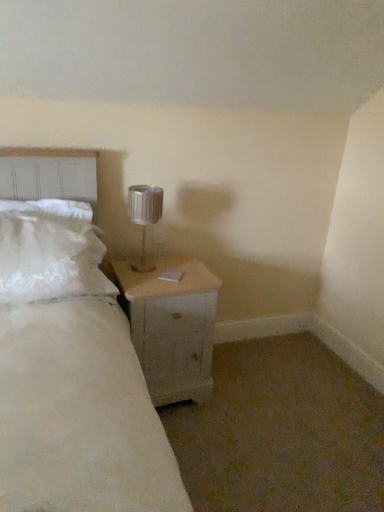
What do you see at coordinates (50, 252) in the screenshot? I see `white fluffy pillow at left` at bounding box center [50, 252].

Identify the location of metallic silver lamp at upper right. The height and width of the screenshot is (512, 384). (145, 219).

This screenshot has width=384, height=512. Find the location of `pillow in front of the metallic silver lamp at upper right`. pillow in front of the metallic silver lamp at upper right is located at coordinates (50, 252).

Can you tell me how much white fluffy pillow at left and metallic silver lamp at upper right differ in facing direction?

The facing directions of white fluffy pillow at left and metallic silver lamp at upper right are 1.27 degrees apart.

Is point (74, 209) less distant than point (138, 195)?

Yes, it is in front of point (138, 195).

Considering the sizes of white fluffy pillow at left and metallic silver lamp at upper right in the image, is white fluffy pillow at left wider or thinner than metallic silver lamp at upper right?

Clearly, white fluffy pillow at left has more width compared to metallic silver lamp at upper right.

In terms of width, does white wood nightstand at lower right look wider or thinner when compared to metallic silver lamp at upper right?

In the image, white wood nightstand at lower right appears to be wider than metallic silver lamp at upper right.

From the image's perspective, who appears lower, white wood nightstand at lower right or metallic silver lamp at upper right?

From the image's view, white wood nightstand at lower right is below.

Would you consider white wood nightstand at lower right to be distant from metallic silver lamp at upper right?

Actually, white wood nightstand at lower right and metallic silver lamp at upper right are a little close together.

You are a GUI agent. You are given a task and a screenshot of the screen. Output one action in this format:
    pyautogui.click(x=<x>, y=<y>)
    Task: Click on the lamp behind the white wood nightstand at lower right
    This screenshot has height=512, width=384.
    Given the screenshot: What is the action you would take?
    pyautogui.click(x=145, y=219)

Where is `nightstand that is under the metallic silver lamp at upper right (from a real-world perspective)`? nightstand that is under the metallic silver lamp at upper right (from a real-world perspective) is located at coordinates (172, 326).

From the image's perspective, is metallic silver lamp at upper right located above or below white wood nightstand at lower right?

metallic silver lamp at upper right is situated higher than white wood nightstand at lower right in the image.

Looking at this image, is metallic silver lamp at upper right touching white wood nightstand at lower right?

No, metallic silver lamp at upper right is not next to white wood nightstand at lower right.

Is metallic silver lamp at upper right located outside white wood nightstand at lower right?

Yes, metallic silver lamp at upper right is outside of white wood nightstand at lower right.

From the image's perspective, which one is positioned lower, metallic silver lamp at upper right or white fluffy pillow at left?

white fluffy pillow at left appears lower in the image.

Does metallic silver lamp at upper right contain white fluffy pillow at left?

No, white fluffy pillow at left is not surrounded by metallic silver lamp at upper right.

From their relative heights in the image, would you say metallic silver lamp at upper right is taller or shorter than white fluffy pillow at left?

Considering their sizes, metallic silver lamp at upper right has less height than white fluffy pillow at left.

Which of these two, metallic silver lamp at upper right or white fluffy pillow at left, is thinner?

Thinner between the two is metallic silver lamp at upper right.

Can you confirm if white wood nightstand at lower right is bigger than white fluffy pillow at left?

Yes.

From the image's perspective, which is above, white wood nightstand at lower right or white fluffy pillow at left?

white fluffy pillow at left is shown above in the image.

Does white wood nightstand at lower right appear on the left side of white fluffy pillow at left?

In fact, white wood nightstand at lower right is to the right of white fluffy pillow at left.

Between white wood nightstand at lower right and white fluffy pillow at left, which one has larger width?

white wood nightstand at lower right is wider.

Is white fluffy pillow at left wider than white wood nightstand at lower right?

No, white fluffy pillow at left is not wider than white wood nightstand at lower right.

Considering the positions of objects white fluffy pillow at left and white wood nightstand at lower right in the image provided, who is in front, white fluffy pillow at left or white wood nightstand at lower right?

white fluffy pillow at left.

Is white fluffy pillow at left surrounding white wood nightstand at lower right?

No, white wood nightstand at lower right is located outside of white fluffy pillow at left.

Does white fluffy pillow at left have a larger size compared to white wood nightstand at lower right?

Incorrect, white fluffy pillow at left is not larger than white wood nightstand at lower right.

Identify the location of lamp above the white fluffy pillow at left (from the image's perspective). This screenshot has height=512, width=384. (145, 219).

What are the coordinates of `nightstand below the metallic silver lamp at upper right (from the image's perspective)` in the screenshot? It's located at tap(172, 326).

Which object lies nearer to the anchor point white fluffy pillow at left, metallic silver lamp at upper right or white wood nightstand at lower right?

white wood nightstand at lower right.

Estimate the real-world distances between objects in this image. Which object is closer to white wood nightstand at lower right, white fluffy pillow at left or metallic silver lamp at upper right?

The object closer to white wood nightstand at lower right is metallic silver lamp at upper right.

When comparing their distances from metallic silver lamp at upper right, does white wood nightstand at lower right or white fluffy pillow at left seem closer?

white wood nightstand at lower right is positioned closer to the anchor metallic silver lamp at upper right.

When comparing their distances from metallic silver lamp at upper right, does white fluffy pillow at left or white wood nightstand at lower right seem closer?

white wood nightstand at lower right is positioned closer to the anchor metallic silver lamp at upper right.

Based on their spatial positions, is metallic silver lamp at upper right or white fluffy pillow at left closer to white wood nightstand at lower right?

metallic silver lamp at upper right lies closer to white wood nightstand at lower right than the other object.

From the image, which object appears to be farther from white fluffy pillow at left, white wood nightstand at lower right or metallic silver lamp at upper right?

metallic silver lamp at upper right is further to white fluffy pillow at left.

Find the location of a particular element. The width and height of the screenshot is (384, 512). pillow between metallic silver lamp at upper right and white wood nightstand at lower right vertically is located at coordinates (50, 252).